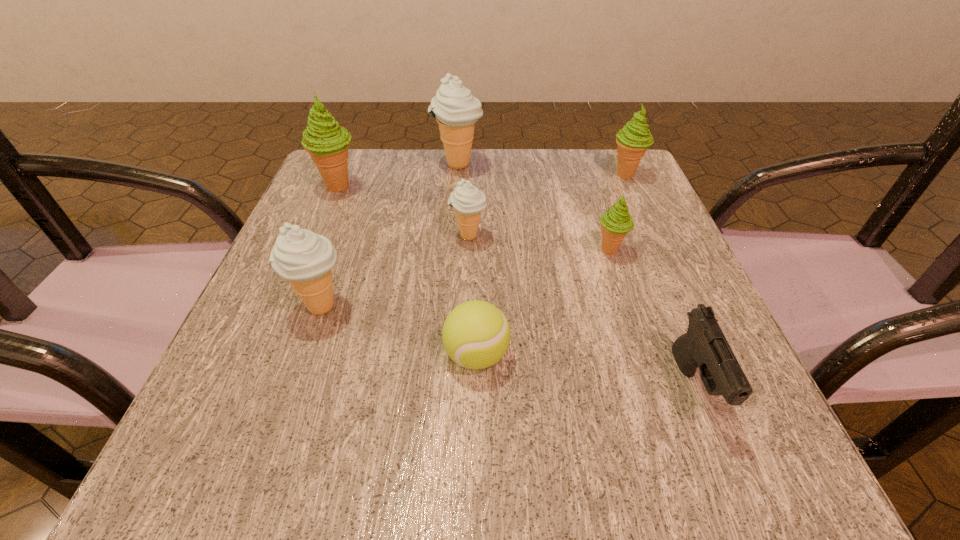
Find the location of a particular element. This screenshot has width=960, height=540. pistol positioned at the right edge is located at coordinates 704,345.

This screenshot has width=960, height=540. I want to click on object that is at the far left corner, so click(327, 143).

Locate an element on the screen. object that is at the far right corner is located at coordinates 633,139.

Find the location of `object that is at the near right corner`. object that is at the near right corner is located at coordinates (704, 345).

Where is `free space at the far edge of the desktop`? free space at the far edge of the desktop is located at coordinates (522, 166).

I want to click on free location at the near edge, so click(x=520, y=446).

Find the location of a particular element. free space at the left edge is located at coordinates (339, 226).

The width and height of the screenshot is (960, 540). Find the location of `vacant space at the right edge of the desktop`. vacant space at the right edge of the desktop is located at coordinates (631, 262).

The image size is (960, 540). Identify the location of free point at the far left corner. (348, 173).

This screenshot has height=540, width=960. Identify the location of blank space at the near right corner of the desktop. (714, 449).